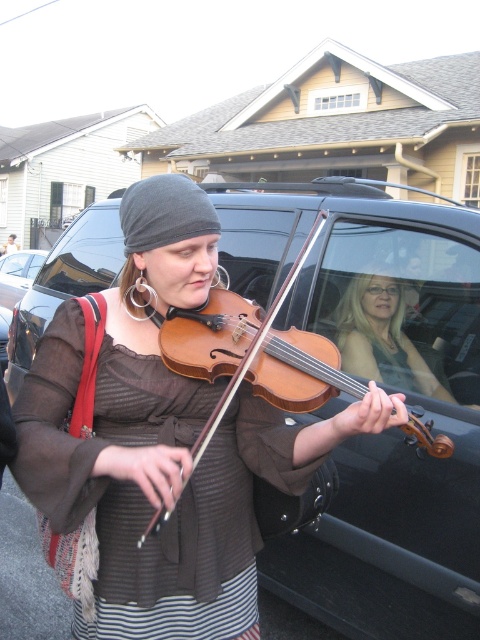
Image resolution: width=480 pixels, height=640 pixels. In order to click on matte brown hair at center in this screenshot , I will do `click(382, 337)`.

Does shiny black car at center have a larger size compared to wooden violin at center?

Yes, shiny black car at center is bigger than wooden violin at center.

Which is in front, point (387, 596) or point (232, 388)?

Point (232, 388) is in front.

Where is `shiny black car at center`? This screenshot has height=640, width=480. shiny black car at center is located at coordinates (382, 387).

Does shiny black car at center have a lesser height compared to shiny silver car at center?

Incorrect, shiny black car at center's height does not fall short of shiny silver car at center's.

Between point (383, 509) and point (0, 289), which one is positioned in front?

Point (383, 509) is more forward.

This screenshot has height=640, width=480. Identify the location of shiny black car at center. (382, 387).